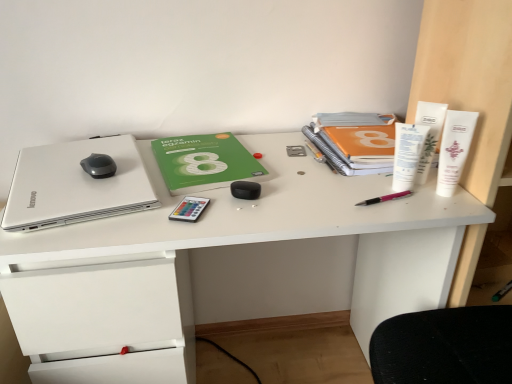
You are a GUI agent. You are given a task and a screenshot of the screen. Output one action in this format:
    pyautogui.click(x=<x>, y=<y>)
    Task: Click on the free space that is in between white matte laptop at left and black plastic remote control at center-left, the 1th stationery in the left-to-right sequence
    Image resolution: width=512 pixels, height=384 pixels.
    Given the screenshot: What is the action you would take?
    pyautogui.click(x=140, y=215)